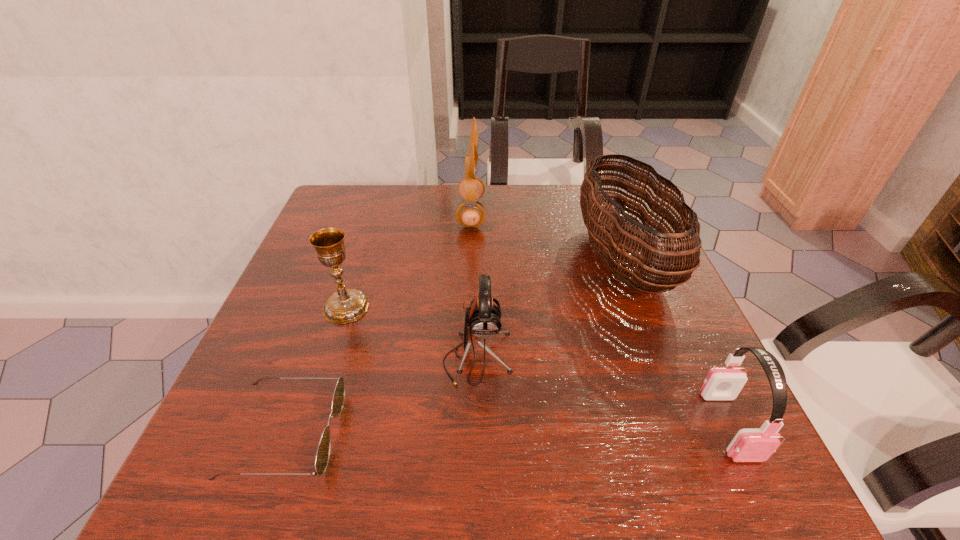
Find the location of a particular element. This screenshot has width=960, height=540. the tallest object is located at coordinates pos(469,214).

This screenshot has width=960, height=540. Find the location of `the tallest earphone`. the tallest earphone is located at coordinates (469, 214).

At what (x,y) coordinates should I click in order to perform the action: click on basket. Please return your answer as a coordinate pair (x, y). Looking at the image, I should click on (632, 259).

Where is `chalice`? Image resolution: width=960 pixels, height=540 pixels. chalice is located at coordinates (346, 305).

The image size is (960, 540). I want to click on the second nearest earphone, so click(x=482, y=319).

Locate an element on the screen. the rightmost earphone is located at coordinates (749, 445).

I want to click on the shortest object, so click(x=322, y=457).

The width and height of the screenshot is (960, 540). What are the coordinates of `free space located on the front-facing side of the tallest earphone` in the screenshot? It's located at (552, 213).

In order to click on blank space located 0.110m on the back of the basket in this screenshot , I will do `click(596, 192)`.

Identify the location of vacant space located 0.310m on the right of the chalice. (517, 307).